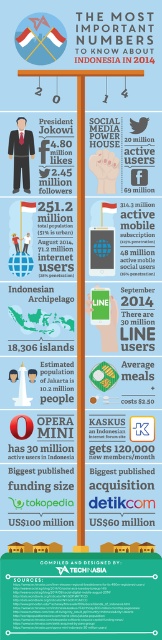
Question: Does white paper text at upper center have a larger size compared to matte black mobile phone at center?

Choices:
 (A) yes
 (B) no

Answer: (A)

Question: Is matte black mobile phone at center thinner than white glossy flag at center?

Choices:
 (A) yes
 (B) no

Answer: (A)

Question: Does matte black mobile phone at center have a smaller size compared to white glossy flag at center?

Choices:
 (A) no
 (B) yes

Answer: (A)

Question: Which of the following is the farthest from the observer?

Choices:
 (A) (33, 24)
 (B) (144, 268)

Answer: (B)

Question: Which point is closer to the camera?

Choices:
 (A) (129, 60)
 (B) (42, 19)
 (C) (129, 220)

Answer: (B)

Question: Which object is closer to the camera taking this photo?

Choices:
 (A) white paper text at upper center
 (B) white glossy flag at center

Answer: (A)